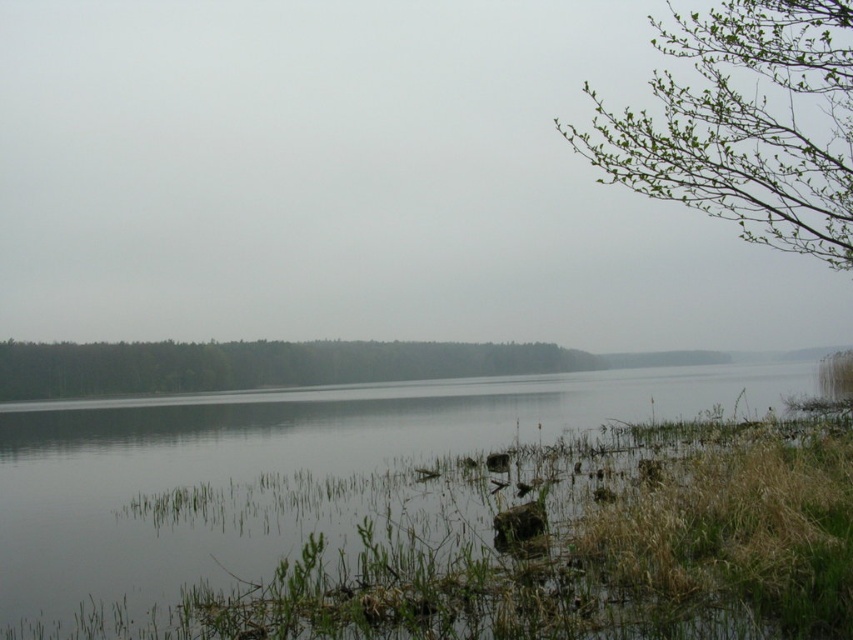
Does clear water at center have a smaller size compared to green leafy forest at center?

No.

Between clear water at center and green leafy forest at center, which one has more height?

With more height is green leafy forest at center.

What do you see at coordinates (303, 474) in the screenshot?
I see `clear water at center` at bounding box center [303, 474].

Find the location of `clear water at center`. clear water at center is located at coordinates (303, 474).

Between point (291, 520) and point (796, 120), which one is positioned behind?

The point (796, 120) is more distant.

At what (x,y) coordinates should I click in order to perform the action: click on clear water at center. Please return your answer as a coordinate pair (x, y). The width and height of the screenshot is (853, 640). Looking at the image, I should click on (303, 474).

Find the location of a particular element. The width and height of the screenshot is (853, 640). clear water at center is located at coordinates (303, 474).

Who is more distant from viewer, [624,118] or [419,372]?

The point [624,118] is behind.

Is green leafy branch at upper right positioned behind green leafy forest at center?

No, it is not.

Measure the distance between point (849, 108) and camera.

A distance of 57.37 meters exists between point (849, 108) and camera.

The image size is (853, 640). What are the coordinates of `green leafy branch at upper right` in the screenshot? It's located at (744, 125).